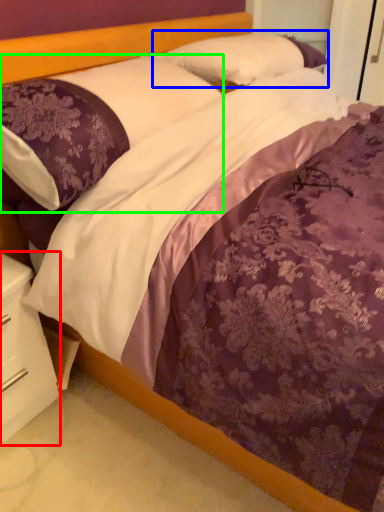
Question: Which is nearer to the nightstand (highlighted by a red box)? pillow (highlighted by a blue box) or pillow (highlighted by a green box).

Choices:
 (A) pillow
 (B) pillow

Answer: (B)